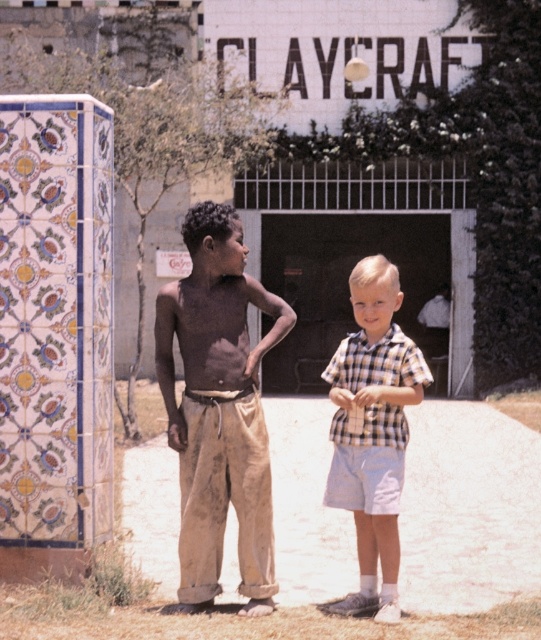
Who is more distant from viewer, (278,337) or (397,492)?

The point (278,337) is more distant.

In the scene shown: Does brown cotton pants at center have a lesser width compared to checkered fabric shirt at center?

In fact, brown cotton pants at center might be wider than checkered fabric shirt at center.

Measure the distance between brown cotton pants at center and camera.

brown cotton pants at center is 7.09 meters from camera.

I want to click on brown cotton pants at center, so click(x=219, y=410).